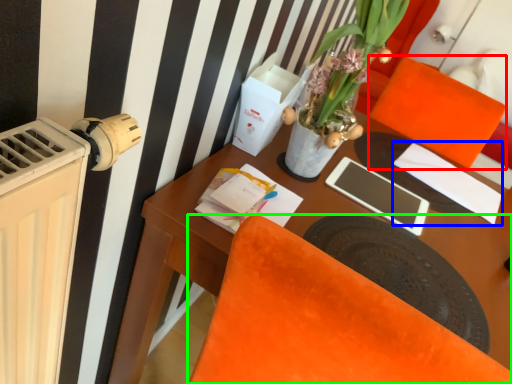
Question: Which is farther away from armchair (highlighted by a red box)? notepad (highlighted by a blue box) or chair (highlighted by a green box)?

Choices:
 (A) notepad
 (B) chair

Answer: (B)